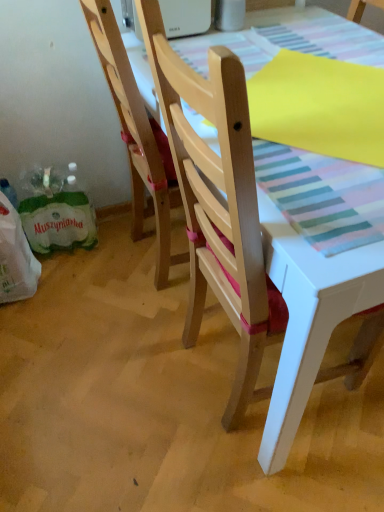
The image size is (384, 512). I want to click on blank area to the left of wooden chair at center, acting as the first chair starting from the right, so click(132, 382).